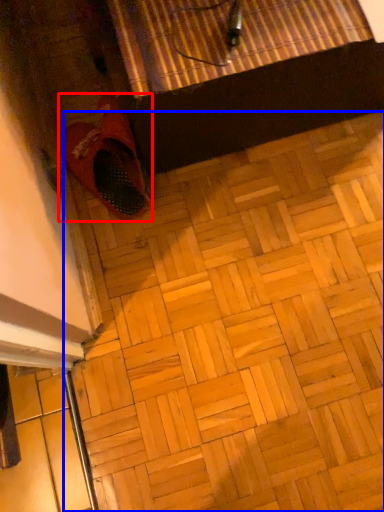
Question: Which object is closer to the camera taking this photo, footwear (highlighted by a red box) or tile (highlighted by a blue box)?

Choices:
 (A) footwear
 (B) tile

Answer: (B)